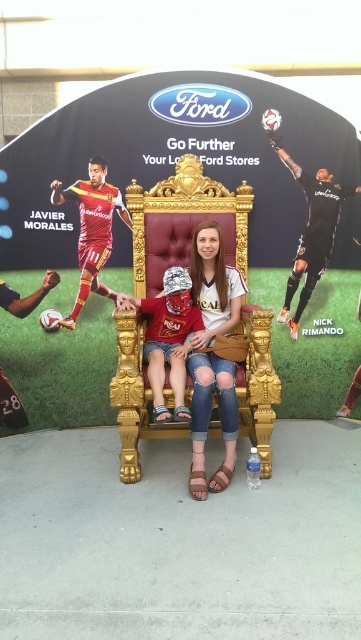
Question: Is denim jeans at center in front of matte red soccer jersey at left?

Choices:
 (A) no
 (B) yes

Answer: (B)

Question: Which point is farther to the camera?

Choices:
 (A) (292, 160)
 (B) (354, 225)

Answer: (B)

Question: Which point appears farthest from the camera in this image?

Choices:
 (A) (331, 252)
 (B) (227, 419)
 (C) (184, 365)
 (D) (125, 209)

Answer: (A)

Question: Is denim jeans at center wider than black jersey at upper right?

Choices:
 (A) yes
 (B) no

Answer: (B)

Question: Which point is closer to the camera taking this photo?

Choices:
 (A) (119, 193)
 (B) (310, 272)

Answer: (A)

Question: Does denim jeans at center appear on the right side of matte red shirt at center?

Choices:
 (A) yes
 (B) no

Answer: (A)